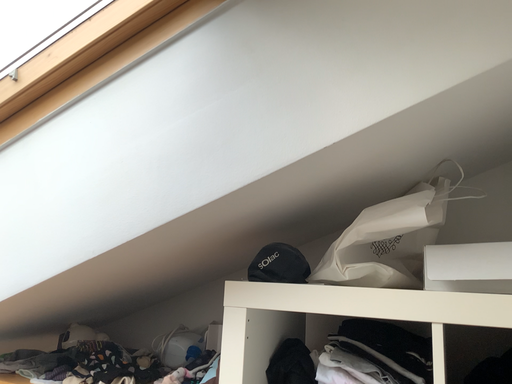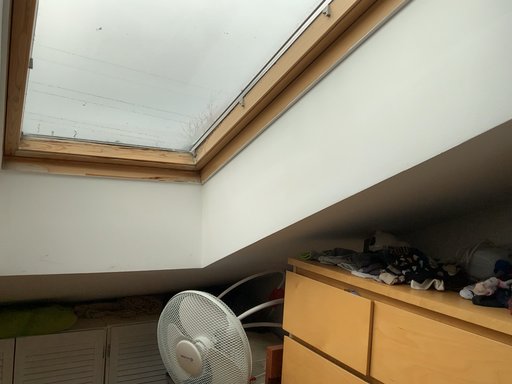
Question: Which way did the camera rotate in the video?

Choices:
 (A) rotated upward
 (B) rotated downward

Answer: (B)